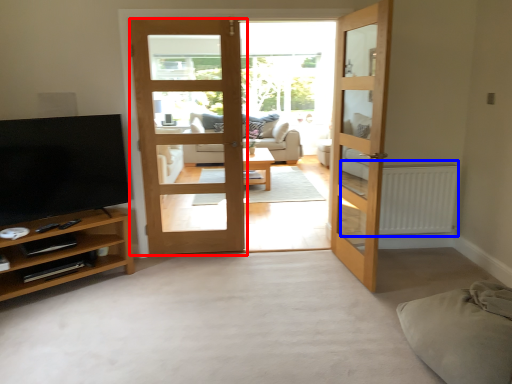
Question: Which object appears farthest to the camera in this image, door (highlighted by a red box) or radiator (highlighted by a blue box)?

Choices:
 (A) door
 (B) radiator

Answer: (B)